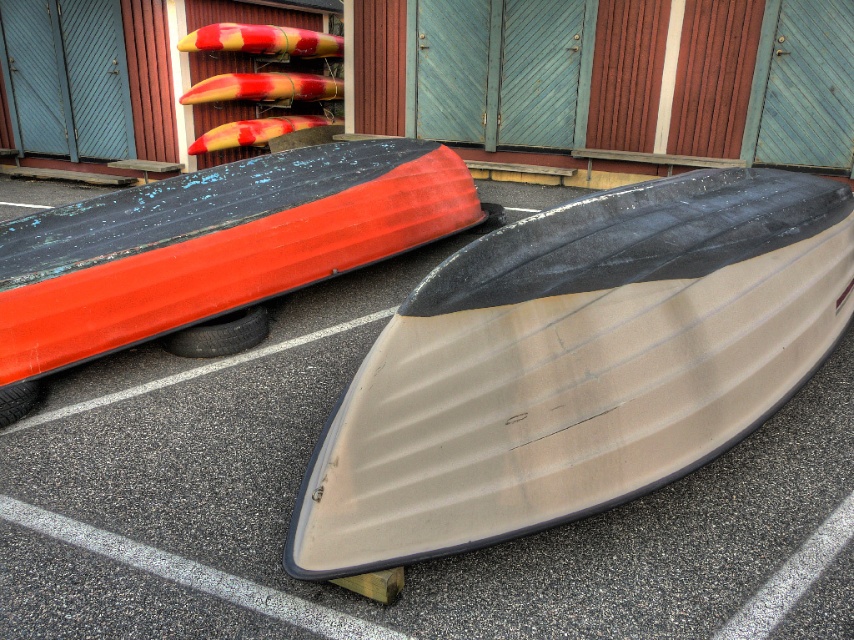
Does red-yellow striped surfboard at center have a lesser width compared to red-yellow foam surfboard at center?

Incorrect, red-yellow striped surfboard at center's width is not less than red-yellow foam surfboard at center's.

Does red-yellow striped surfboard at center have a greater height compared to red-yellow foam surfboard at center?

Indeed, red-yellow striped surfboard at center has a greater height compared to red-yellow foam surfboard at center.

You are a GUI agent. You are given a task and a screenshot of the screen. Output one action in this format:
    pyautogui.click(x=<x>, y=<y>)
    Task: Click on the red-yellow striped surfboard at center
    Image resolution: width=854 pixels, height=640 pixels.
    Given the screenshot: What is the action you would take?
    pyautogui.click(x=262, y=88)

Is smooth beige boat at center bigger than red and yellow striped surfboard at upper center?

Incorrect, smooth beige boat at center is not larger than red and yellow striped surfboard at upper center.

Measure the distance between point (229, 417) and camera.

They are 13.78 feet apart.

Find the location of `smooth beige boat at center`. smooth beige boat at center is located at coordinates pos(297,484).

Locate an element on the screen. This screenshot has height=640, width=854. smooth beige boat at center is located at coordinates (297, 484).

Which is behind, point (613, 602) or point (246, 90)?

The point (246, 90) is behind.

Is smooth beige boat at center above red-yellow striped surfboard at center?

No.

Who is more distant from viewer, (x=246, y=464) or (x=226, y=99)?

Positioned behind is point (x=226, y=99).

This screenshot has height=640, width=854. I want to click on smooth beige boat at center, so click(x=297, y=484).